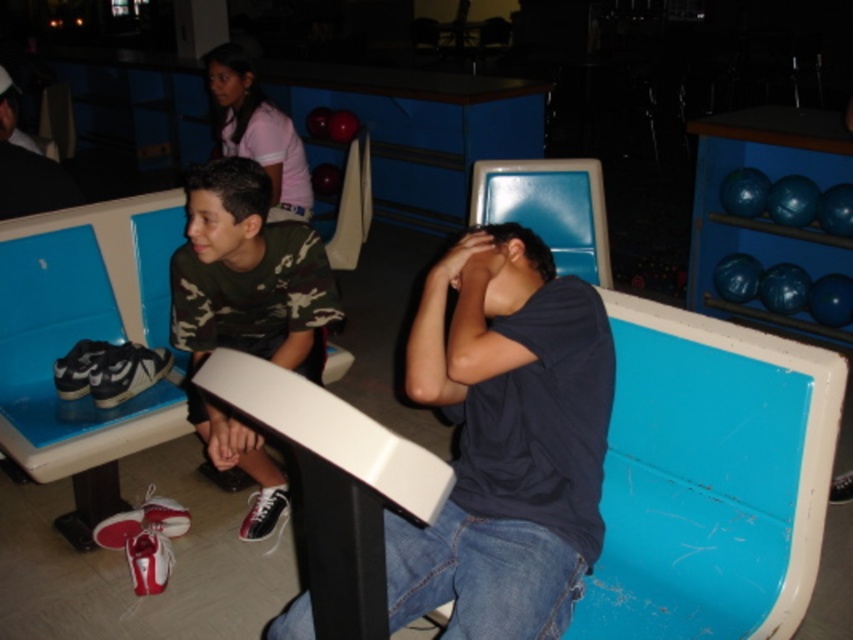
Does camo fabric shirt at center appear under matte black shirt at center?

Correct, camo fabric shirt at center is located below matte black shirt at center.

Does camo fabric shirt at center lie behind matte black shirt at center?

No, camo fabric shirt at center is closer to the viewer.

Who is more distant from viewer, (x=190, y=248) or (x=12, y=86)?

The point (x=12, y=86) is more distant.

The width and height of the screenshot is (853, 640). Identify the location of camo fabric shirt at center. (247, 308).

Does dark blue t-shirt at center appear over camo fabric shirt at center?

No, dark blue t-shirt at center is not above camo fabric shirt at center.

Is point (398, 550) closer to viewer compared to point (223, 420)?

Yes.

Where is `dark blue t-shirt at center`? This screenshot has width=853, height=640. dark blue t-shirt at center is located at coordinates pos(506,440).

Find the location of a particular element. dark blue t-shirt at center is located at coordinates (506, 440).

Is dark blue t-shirt at center to the left of matte black shirt at center from the viewer's perspective?

Incorrect, dark blue t-shirt at center is not on the left side of matte black shirt at center.

Does dark blue t-shirt at center have a lesser width compared to matte black shirt at center?

No, dark blue t-shirt at center is not thinner than matte black shirt at center.

Identify the location of dark blue t-shirt at center. (506, 440).